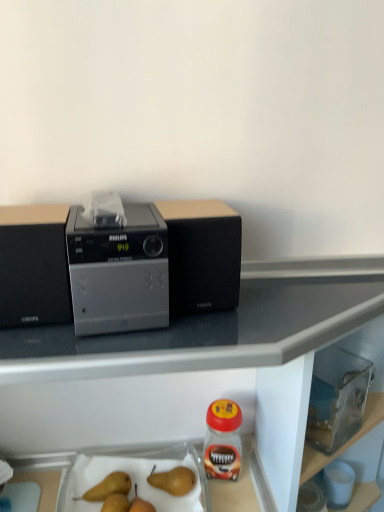
Question: Considering the positions of point (127, 480) and point (162, 416), is point (127, 480) closer or farther from the camera than point (162, 416)?

Choices:
 (A) farther
 (B) closer

Answer: (B)

Question: In terms of height, does smooth brown pears at lower center, the second fruit positioned from the right, look taller or shorter compared to black glossy table at upper center?

Choices:
 (A) tall
 (B) short

Answer: (B)

Question: Which object is positioned closest to the black glossy table at upper center?

Choices:
 (A) clear glass jar at lower right
 (B) transparent plastic container at lower right
 (C) satin silver radio at center
 (D) black matte speaker at center, the second kitchen appliance from the left
 (E) yellow matte pear at lower center, acting as the 1th fruit starting from the right

Answer: (A)

Question: Which object is the farthest from the yellow matte pear at lower center, which is the 3th fruit from left to right?

Choices:
 (A) smooth brown pears at lower center, the second fruit positioned from the right
 (B) satin silver radio at center
 (C) transparent plastic container at lower right
 (D) black glossy table at upper center
 (E) clear glass jar at lower right

Answer: (B)